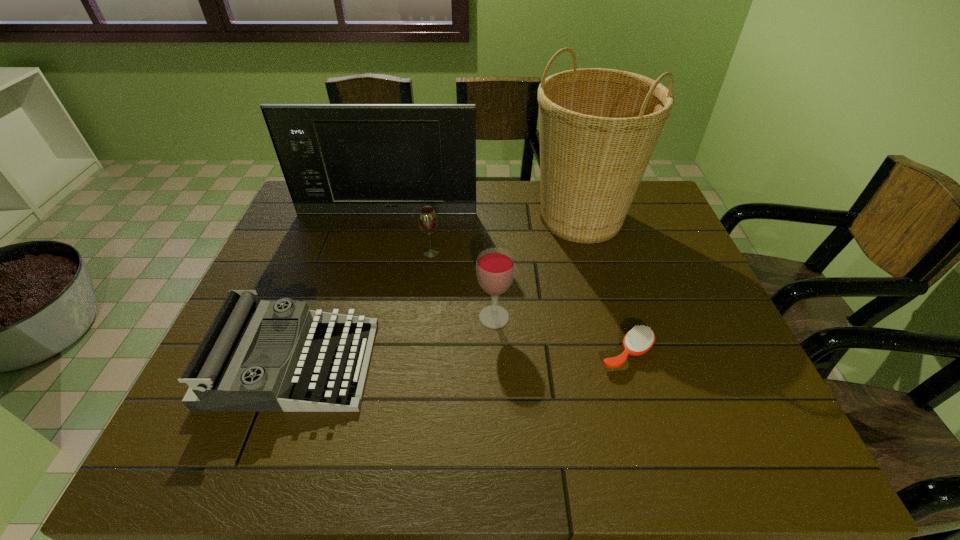
You are a GUI agent. You are given a task and a screenshot of the screen. Output one action in this format:
    pyautogui.click(x=<x>, y=<y>)
    Task: Click on the basket
    
    Given the screenshot: What is the action you would take?
    pyautogui.click(x=598, y=128)

You are a GUI agent. You are given a task and a screenshot of the screen. Output one action in this format:
    pyautogui.click(x=<x>, y=<y>)
    Task: Click on the microwave oven
    This screenshot has width=960, height=540.
    Given the screenshot: What is the action you would take?
    pyautogui.click(x=346, y=159)

The image size is (960, 540). Identify the location of the nearer wineglass. (495, 267).

I want to click on the fourth shortest object, so click(495, 267).

The width and height of the screenshot is (960, 540). What are the coordinates of `the left wineglass` in the screenshot? It's located at (427, 218).

I want to click on the shorter wineglass, so [x=427, y=218].

I want to click on typewriter, so point(257,356).

Identify the location of hairbrush. The image size is (960, 540). (640, 339).

This screenshot has height=540, width=960. Find the location of `free space located on the front of the tallest object`. free space located on the front of the tallest object is located at coordinates click(612, 332).

The height and width of the screenshot is (540, 960). I want to click on free space located 0.110m on the front panel of the fifth shortest object, so click(x=381, y=237).